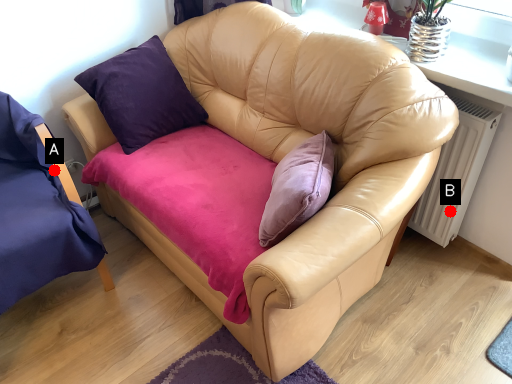
Question: Two points are circled on the image, labeled by A and B beside each circle. Which point appears farthest from the camera in this image?

Choices:
 (A) A is further
 (B) B is further

Answer: (B)